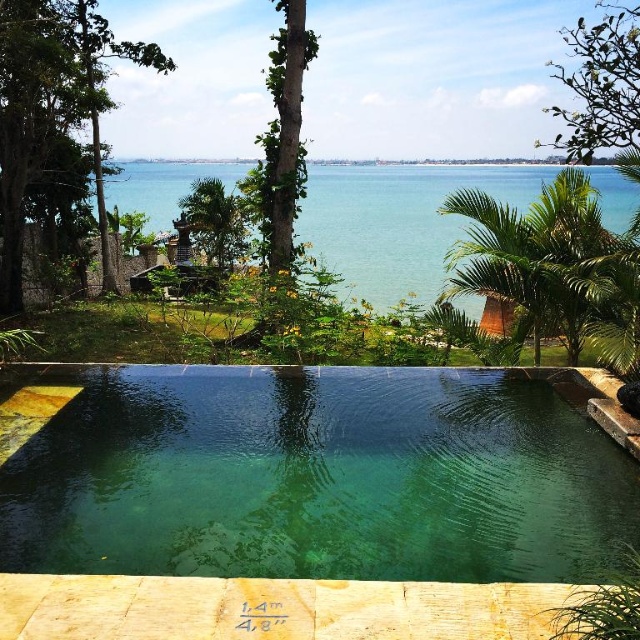
You are standing at the edge of the pool and want to see both the clear blue water at center and the green leafy palm tree at center. Which object is closer to you?

The clear blue water at center is closer to you than the green leafy palm tree at center.

You are standing at the edge of the pool and want to look at the clear blue water at center and the green leafy palm tree at right. Which one is closer to you?

The clear blue water at center is closer to you because the green leafy palm tree at right is behind it.